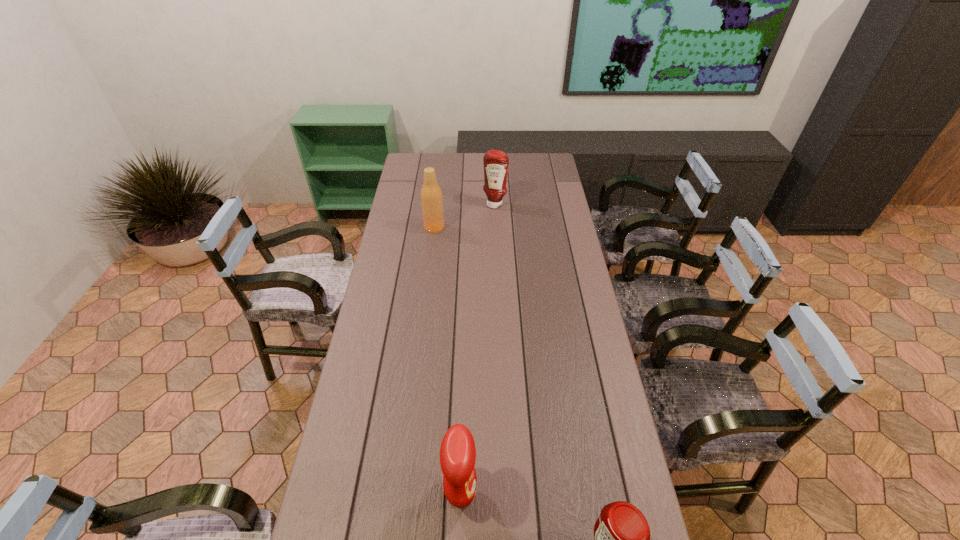
Where is `vacant area at the far edge of the desktop`? vacant area at the far edge of the desktop is located at coordinates (440, 174).

Where is `free region at the left edge`? free region at the left edge is located at coordinates (372, 437).

Find the location of a particular element. vacant space at the right edge of the desktop is located at coordinates click(578, 384).

This screenshot has height=540, width=960. I want to click on vacant position at the far left corner of the desktop, so click(411, 159).

Find the location of a particular element. The image size is (960, 540). vacant space in between the second nearest object and the leftmost object is located at coordinates (447, 360).

This screenshot has width=960, height=540. I want to click on vacant point located between the second object from left to right and the third object from left to right, so click(x=478, y=348).

Locate an element on the screen. free spot between the beer bottle and the leftmost condiment is located at coordinates (447, 360).

The width and height of the screenshot is (960, 540). Find the location of `vacant space that is in between the leftmost condiment and the leftmost object`. vacant space that is in between the leftmost condiment and the leftmost object is located at coordinates (447, 360).

The width and height of the screenshot is (960, 540). Identify the location of free space between the farthest condiment and the second nearest object. (478, 348).

You are a GUI agent. You are given a task and a screenshot of the screen. Output one action in this format:
    pyautogui.click(x=<x>, y=<y>)
    Task: Click on the object that stands as the second closest to the third object from left to right
    The width and height of the screenshot is (960, 540).
    Given the screenshot: What is the action you would take?
    pyautogui.click(x=457, y=452)